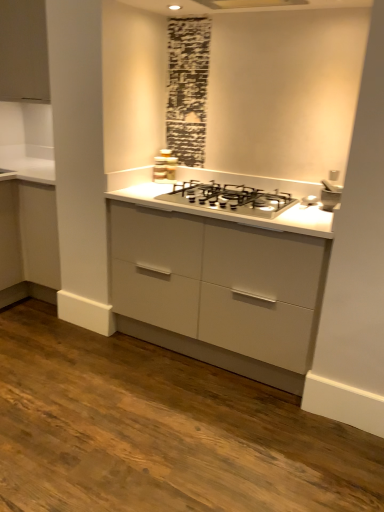
Question: Are white ceramic sink at upper right and matte white cabinet at upper left located far from each other?

Choices:
 (A) no
 (B) yes

Answer: (B)

Question: Is white ceramic sink at upper right taller than matte white cabinet at upper left?

Choices:
 (A) yes
 (B) no

Answer: (B)

Question: Is white ceramic sink at upper right smaller than matte white cabinet at upper left?

Choices:
 (A) no
 (B) yes

Answer: (B)

Question: Is white ceramic sink at upper right next to matte white cabinet at upper left?

Choices:
 (A) no
 (B) yes

Answer: (A)

Question: Is the position of white ceramic sink at upper right more distant than that of matte white cabinet at upper left?

Choices:
 (A) no
 (B) yes

Answer: (A)

Question: Is point (283, 209) closer or farther from the camera than point (6, 45)?

Choices:
 (A) farther
 (B) closer

Answer: (B)

Question: From the image's perspective, is satin silver gas stove at center positioned above or below matte white cabinet at upper left?

Choices:
 (A) above
 (B) below

Answer: (B)

Question: Is satin silver gas stove at center inside or outside of matte white cabinet at upper left?

Choices:
 (A) outside
 (B) inside

Answer: (A)

Question: From their relative heights in the image, would you say satin silver gas stove at center is taller or shorter than matte white cabinet at upper left?

Choices:
 (A) short
 (B) tall

Answer: (A)

Question: Looking at the image, does white ceramic sink at upper right seem bigger or smaller compared to matte white cabinet at upper left?

Choices:
 (A) big
 (B) small

Answer: (B)

Question: Considering the positions of white ceramic sink at upper right and matte white cabinet at upper left in the image, is white ceramic sink at upper right taller or shorter than matte white cabinet at upper left?

Choices:
 (A) short
 (B) tall

Answer: (A)

Question: From a real-world perspective, is white ceramic sink at upper right physically located above or below matte white cabinet at upper left?

Choices:
 (A) below
 (B) above

Answer: (A)

Question: Is white ceramic sink at upper right situated inside matte white cabinet at upper left or outside?

Choices:
 (A) inside
 (B) outside

Answer: (B)

Question: Is satin silver stove at center inside or outside of matte white cabinet at upper left?

Choices:
 (A) inside
 (B) outside

Answer: (B)

Question: Considering the positions of satin silver stove at center and matte white cabinet at upper left in the image, is satin silver stove at center bigger or smaller than matte white cabinet at upper left?

Choices:
 (A) big
 (B) small

Answer: (B)